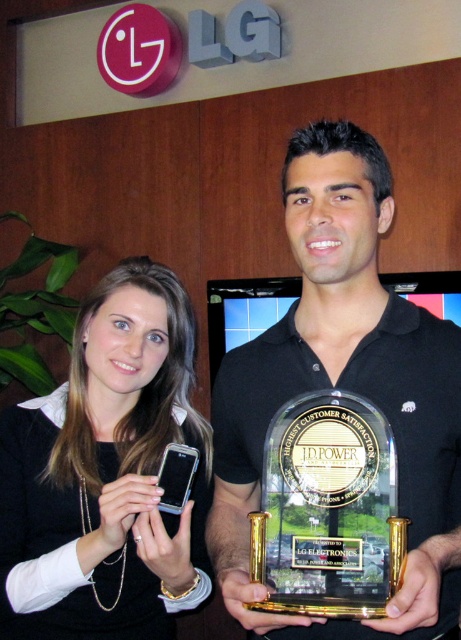
Consider the image. Who is shorter, matte black phone at center or clear acrylic trophy at center?

clear acrylic trophy at center

Who is more distant from viewer, (x=147, y=381) or (x=265, y=556)?

Positioned behind is point (x=147, y=381).

Locate an element on the screen. matte black phone at center is located at coordinates pyautogui.click(x=106, y=474).

Is the position of black glossy trophy at center more distant than that of matte black phone at center?

That is False.

Can you confirm if black glossy trophy at center is bigger than matte black phone at center?

No.

What do you see at coordinates (344, 387) in the screenshot? I see `black glossy trophy at center` at bounding box center [344, 387].

Locate an element on the screen. The height and width of the screenshot is (640, 461). black glossy trophy at center is located at coordinates (344, 387).

Is black glossy trophy at center bigger than clear acrylic trophy at center?

Indeed, black glossy trophy at center has a larger size compared to clear acrylic trophy at center.

Who is shorter, black glossy trophy at center or clear acrylic trophy at center?

clear acrylic trophy at center

Identify the location of black glossy trophy at center. The width and height of the screenshot is (461, 640). (344, 387).

You are a GUI agent. You are given a task and a screenshot of the screen. Output one action in this format:
    pyautogui.click(x=<x>, y=<y>)
    Task: Click on the black glossy trophy at center
    The height and width of the screenshot is (640, 461).
    Given the screenshot: What is the action you would take?
    pyautogui.click(x=344, y=387)